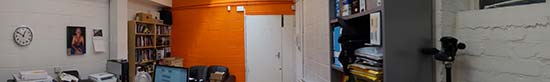
Identify the location of orange wall. Image resolution: width=550 pixels, height=82 pixels. click(x=221, y=33).